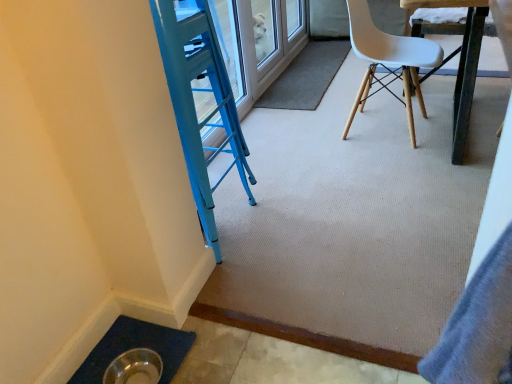
At what (x,y) coordinates should I click in order to perform the action: click on vacant area to the left of metallic dark brown table at upper right. Please return your answer as a coordinate pair (x, y). Looking at the image, I should click on (325, 150).